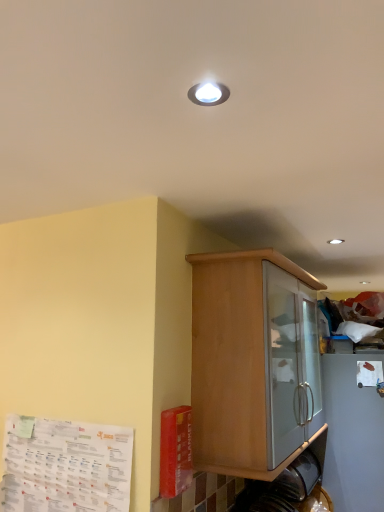
Question: From a real-world perspective, is wooden cabinet at center under white paper at lower left, marked as the 1th paper in a front-to-back arrangement?

Choices:
 (A) yes
 (B) no

Answer: (B)

Question: Can you confirm if wooden cabinet at center is smaller than white paper at lower left, which appears as the 2th paper when viewed from the back?

Choices:
 (A) no
 (B) yes

Answer: (A)

Question: Does wooden cabinet at center turn towards white paper at lower left, which is the second paper in right-to-left order?

Choices:
 (A) no
 (B) yes

Answer: (A)

Question: Does wooden cabinet at center have a greater height compared to white paper at lower left, marked as the 1th paper in a front-to-back arrangement?

Choices:
 (A) yes
 (B) no

Answer: (A)

Question: Considering the relative sizes of wooden cabinet at center and white paper at lower left, marked as the 1th paper in a front-to-back arrangement, in the image provided, is wooden cabinet at center thinner than white paper at lower left, marked as the 1th paper in a front-to-back arrangement,?

Choices:
 (A) yes
 (B) no

Answer: (B)

Question: Is wooden cabinet at center to the right of white paper at lower left, which appears as the 2th paper when viewed from the back, from the viewer's perspective?

Choices:
 (A) yes
 (B) no

Answer: (A)

Question: Is white paper at lower left, arranged as the 1th paper when viewed from the left, inside white matte paper at upper right, arranged as the first paper when viewed from the right?

Choices:
 (A) no
 (B) yes

Answer: (A)

Question: From the image's perspective, is white matte paper at upper right, arranged as the first paper when viewed from the right, above white paper at lower left, which appears as the 2th paper when viewed from the back?

Choices:
 (A) yes
 (B) no

Answer: (A)

Question: From a real-world perspective, is white matte paper at upper right, which ranks as the second paper in front-to-back order, below white paper at lower left, which appears as the 2th paper when viewed from the back?

Choices:
 (A) yes
 (B) no

Answer: (B)

Question: Could you tell me if white matte paper at upper right, the second paper viewed from the left, is turned towards white paper at lower left, marked as the 1th paper in a front-to-back arrangement?

Choices:
 (A) yes
 (B) no

Answer: (B)

Question: Does white matte paper at upper right, arranged as the first paper when viewed from the right, appear on the right side of white paper at lower left, arranged as the 1th paper when viewed from the left?

Choices:
 (A) no
 (B) yes

Answer: (B)

Question: From the image's perspective, is white matte paper at upper right, the second paper viewed from the left, located beneath white paper at lower left, arranged as the 1th paper when viewed from the left?

Choices:
 (A) no
 (B) yes

Answer: (A)

Question: Could you tell me if white matte paper at upper right, which ranks as the second paper in front-to-back order, is facing wooden cabinet at center?

Choices:
 (A) yes
 (B) no

Answer: (B)